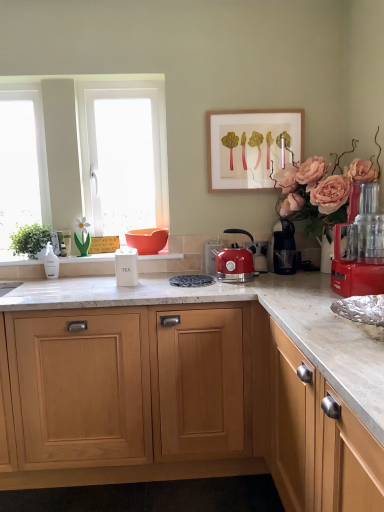
Question: Can you confirm if white glass window at left is wider than blue speckled plate at center?

Choices:
 (A) yes
 (B) no

Answer: (B)

Question: Can you confirm if white glass window at left is smaller than blue speckled plate at center?

Choices:
 (A) yes
 (B) no

Answer: (B)

Question: From the image's perspective, is white glass window at left above blue speckled plate at center?

Choices:
 (A) no
 (B) yes

Answer: (B)

Question: Considering the relative sizes of white glass window at left and blue speckled plate at center in the image provided, is white glass window at left bigger than blue speckled plate at center?

Choices:
 (A) yes
 (B) no

Answer: (A)

Question: Can you confirm if white glass window at left is taller than blue speckled plate at center?

Choices:
 (A) yes
 (B) no

Answer: (A)

Question: From the image's perspective, is white glass window at left below blue speckled plate at center?

Choices:
 (A) no
 (B) yes

Answer: (A)

Question: Can you confirm if white frosted glass at left is shorter than matte red kettle at center, the 2th kitchen appliance positioned from the right?

Choices:
 (A) yes
 (B) no

Answer: (B)

Question: From the image's perspective, is white frosted glass at left located above matte red kettle at center, the 4th kitchen appliance when ordered from left to right?

Choices:
 (A) yes
 (B) no

Answer: (A)

Question: Is white frosted glass at left at the left side of matte red kettle at center, the 4th kitchen appliance from the back?

Choices:
 (A) no
 (B) yes

Answer: (B)

Question: Is white frosted glass at left at the right side of matte red kettle at center, the 4th kitchen appliance when ordered from left to right?

Choices:
 (A) yes
 (B) no

Answer: (B)

Question: Does white frosted glass at left have a greater width compared to matte red kettle at center, the 2th kitchen appliance viewed from the front?

Choices:
 (A) no
 (B) yes

Answer: (A)

Question: Is white frosted glass at left turned away from matte red kettle at center, the 2th kitchen appliance viewed from the front?

Choices:
 (A) yes
 (B) no

Answer: (B)

Question: Is light wood cabinet at center not inside matte orange bowl at center?

Choices:
 (A) yes
 (B) no

Answer: (A)